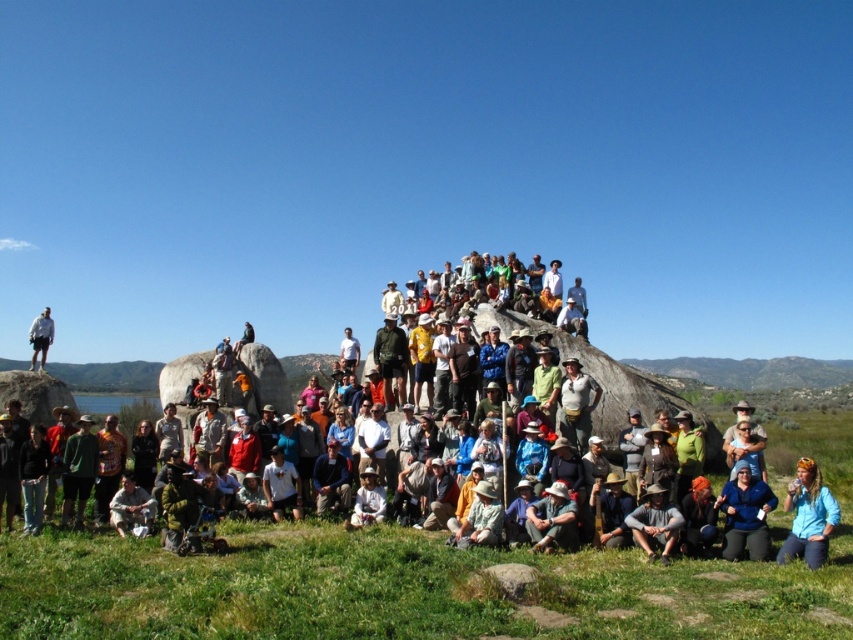
In the scene shown: Between matte khaki pants at center and blue fabric jacket at lower right, which one has less height?

blue fabric jacket at lower right

This screenshot has width=853, height=640. In order to click on matte khaki pants at center in this screenshot , I will do `click(770, 403)`.

Is point (744, 381) positioned in front of point (744, 538)?

That is False.

The width and height of the screenshot is (853, 640). Find the location of `matte khaki pants at center`. matte khaki pants at center is located at coordinates (770, 403).

This screenshot has width=853, height=640. Describe the element at coordinates (746, 515) in the screenshot. I see `blue fabric jacket at lower right` at that location.

Does point (752, 529) lie in front of point (548, 497)?

Yes, it is in front of point (548, 497).

Is point (759, 529) more distant than point (532, 529)?

That is False.

Where is `blue fabric jacket at lower right`? The height and width of the screenshot is (640, 853). blue fabric jacket at lower right is located at coordinates (746, 515).

Can you confirm if blue fabric headband at lower right is positioned to the right of khaki cotton hat at lower center?

Indeed, blue fabric headband at lower right is positioned on the right side of khaki cotton hat at lower center.

Looking at this image, does blue fabric headband at lower right have a lesser width compared to khaki cotton hat at lower center?

In fact, blue fabric headband at lower right might be wider than khaki cotton hat at lower center.

Which is behind, point (809, 492) or point (556, 481)?

Point (556, 481)

Where is `blue fabric headband at lower right`? The image size is (853, 640). blue fabric headband at lower right is located at coordinates (808, 516).